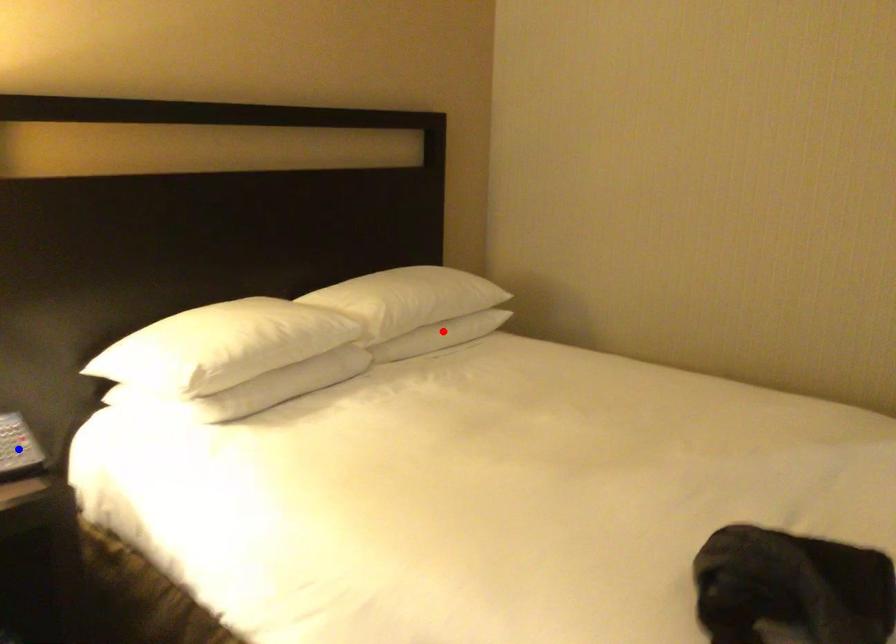
Question: Which of the two points in the image is closer to the camera?

Choices:
 (A) Blue point is closer.
 (B) Red point is closer.

Answer: (A)